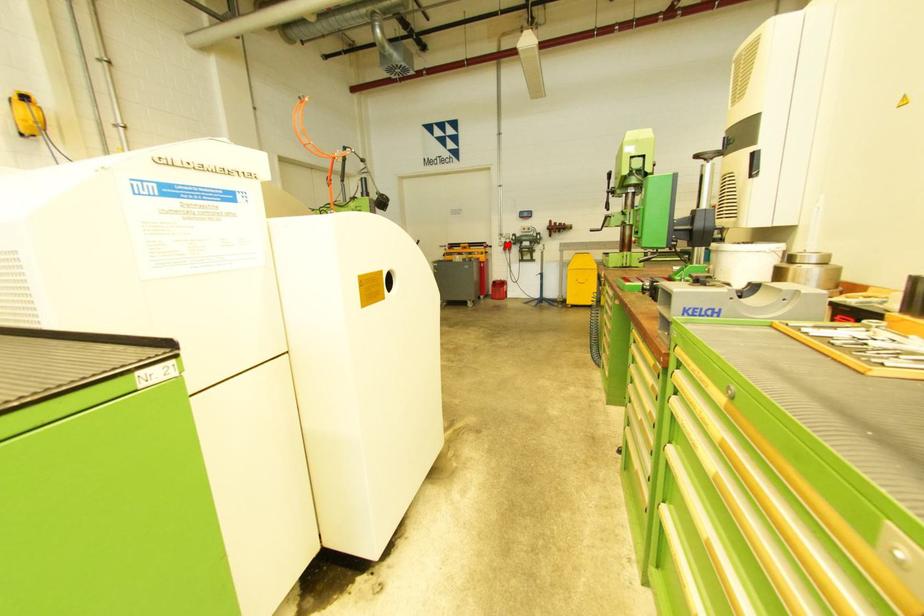
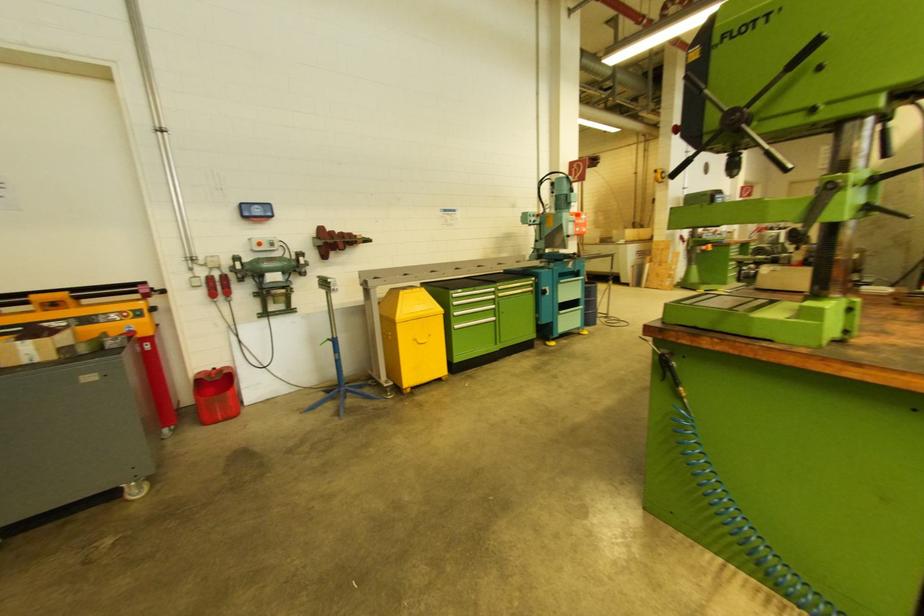
In the second image, find the point that corresponds to the highlighted location in the first image.

(212, 281)